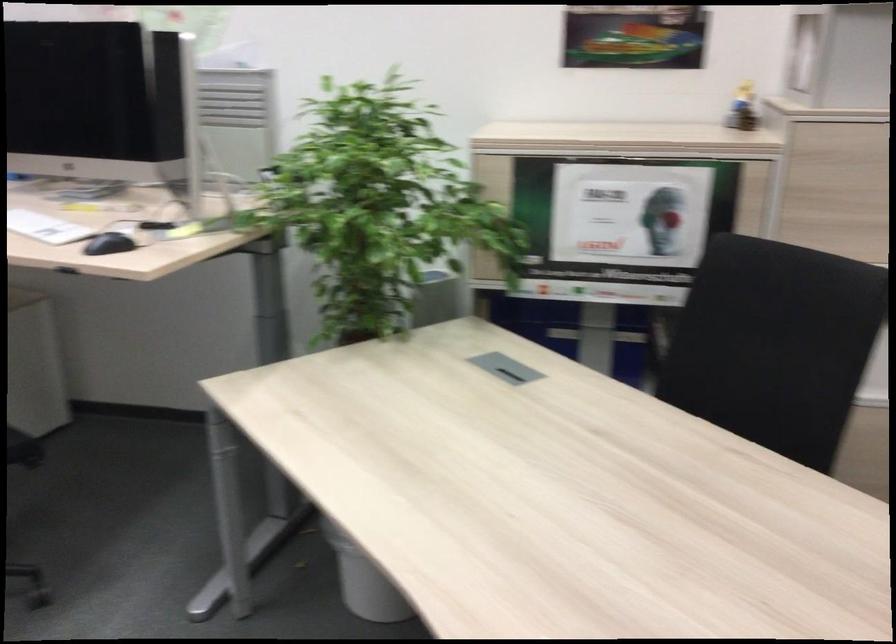
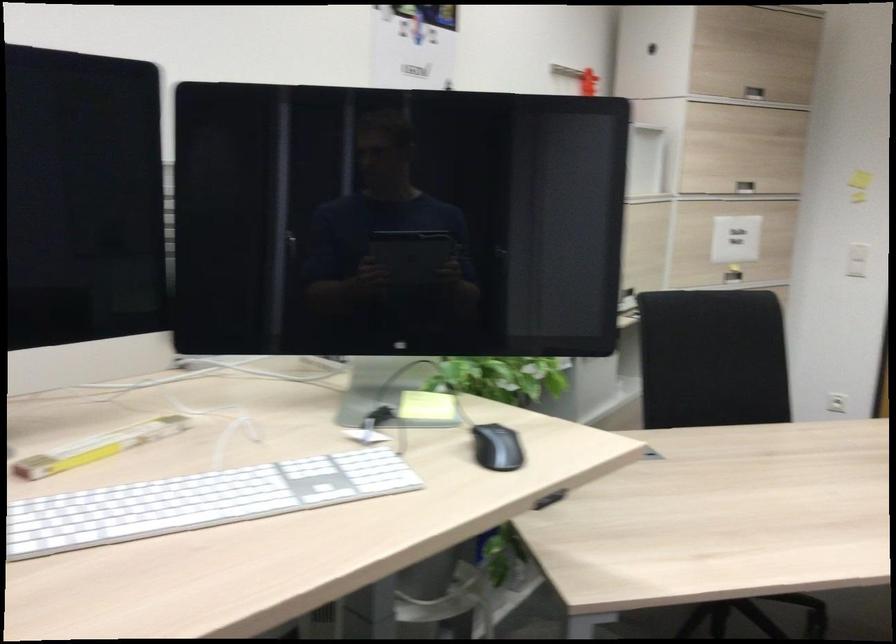
Find the pixel in the second image that matches point (762, 335) in the first image.

(712, 359)